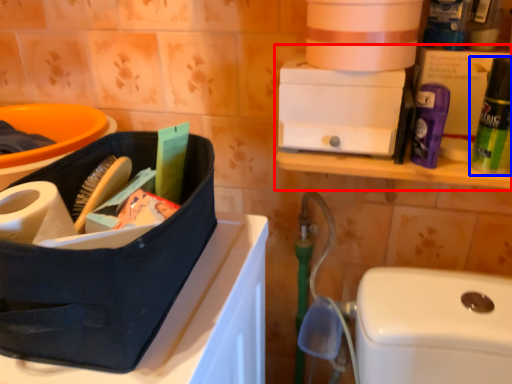
Question: Which point is further to the camera, shelf (highlighted by a red box) or cleaning product (highlighted by a blue box)?

Choices:
 (A) shelf
 (B) cleaning product

Answer: (A)